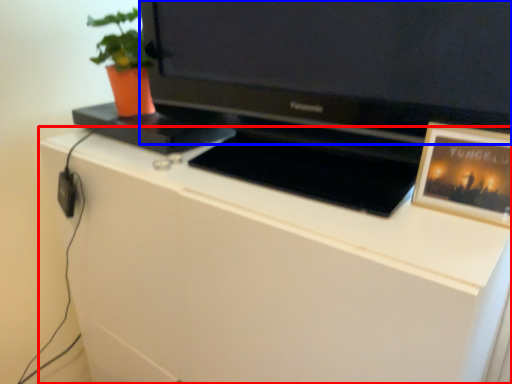
Question: Which point is further to the camera, cabinetry (highlighted by a red box) or television (highlighted by a blue box)?

Choices:
 (A) cabinetry
 (B) television

Answer: (A)